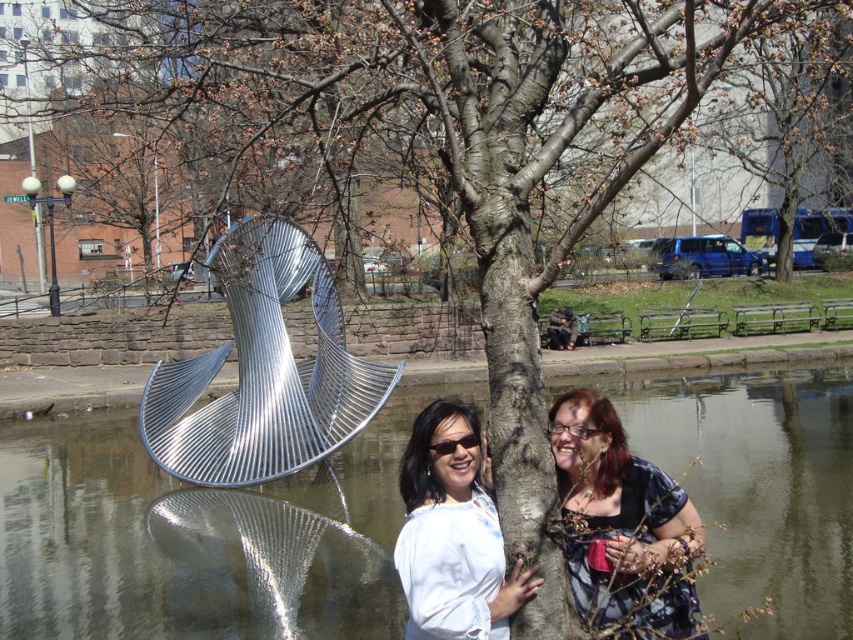
Can you confirm if metallic silver sculpture at center is smaller than patterned fabric dress at center?

Incorrect, metallic silver sculpture at center is not smaller in size than patterned fabric dress at center.

Who is more distant from viewer, (242, 276) or (612, 406)?

Point (242, 276)

You are a GUI agent. You are given a task and a screenshot of the screen. Output one action in this format:
    pyautogui.click(x=<x>, y=<y>)
    Task: Click on the metallic silver sculpture at center
    The image size is (853, 640).
    Given the screenshot: What is the action you would take?
    pyautogui.click(x=263, y=371)

You are a GUI agent. You are given a task and a screenshot of the screen. Output one action in this format:
    pyautogui.click(x=<x>, y=<y>)
    Task: Click on the metallic silver sculpture at center
    
    Given the screenshot: What is the action you would take?
    pyautogui.click(x=263, y=371)

Does metallic water at center have a larger size compared to metallic silver sculpture at center?

Correct, metallic water at center is larger in size than metallic silver sculpture at center.

The width and height of the screenshot is (853, 640). Describe the element at coordinates (114, 541) in the screenshot. I see `metallic water at center` at that location.

The height and width of the screenshot is (640, 853). Identify the location of metallic water at center. (x=114, y=541).

Between metallic silver sculpture at center and white matte shirt at center, which one appears on the right side from the viewer's perspective?

white matte shirt at center is more to the right.

The width and height of the screenshot is (853, 640). Describe the element at coordinates (263, 371) in the screenshot. I see `metallic silver sculpture at center` at that location.

Which is in front, point (241, 477) or point (434, 406)?

Point (434, 406) is more forward.

The image size is (853, 640). Identify the location of metallic silver sculpture at center. (263, 371).